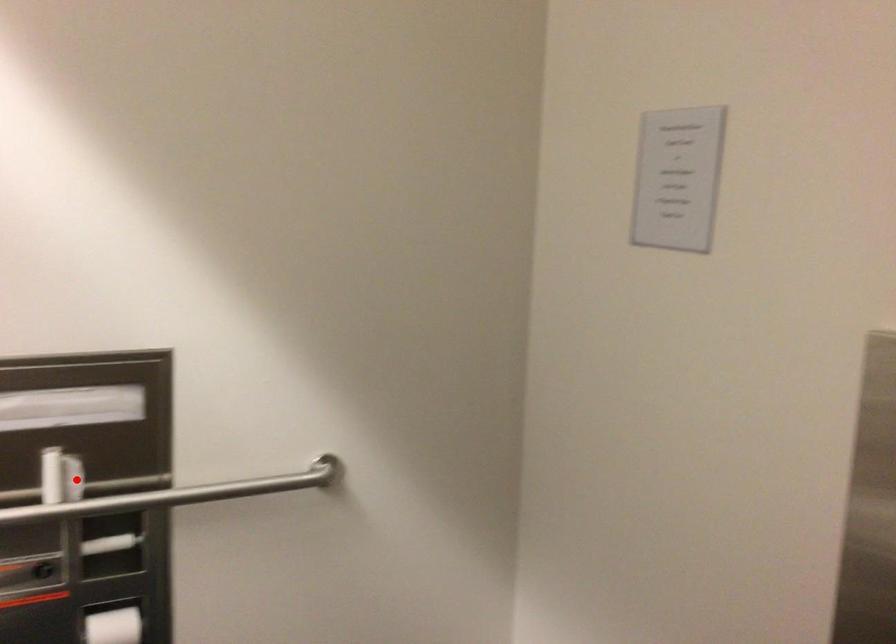
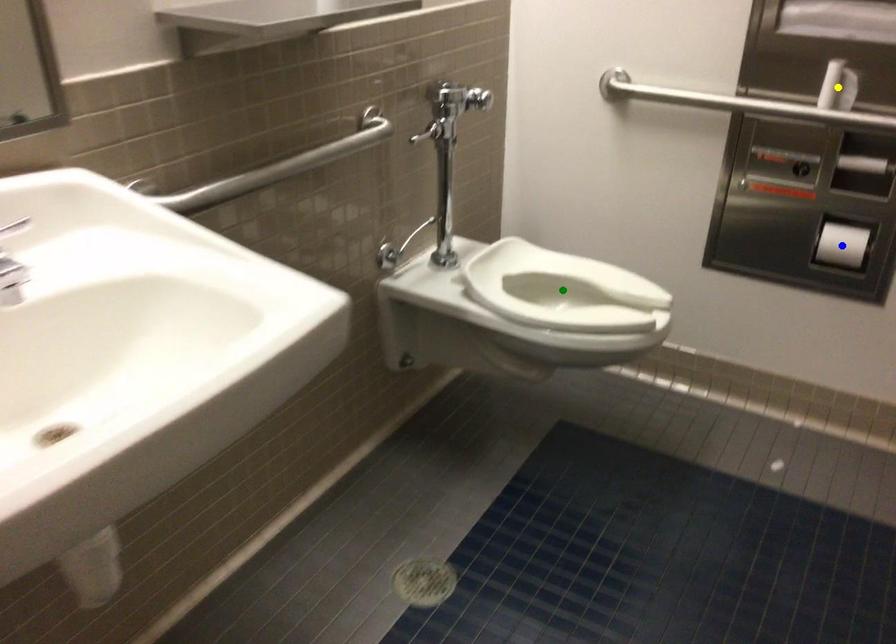
Question: I am providing you with two images of the same scene from different viewpoints. A red point is marked on the first image. You are given multiple points on the second image. Which point in image 2 represents the same 3d spot as the red point in image 1?

Choices:
 (A) yellow point
 (B) blue point
 (C) green point

Answer: (A)